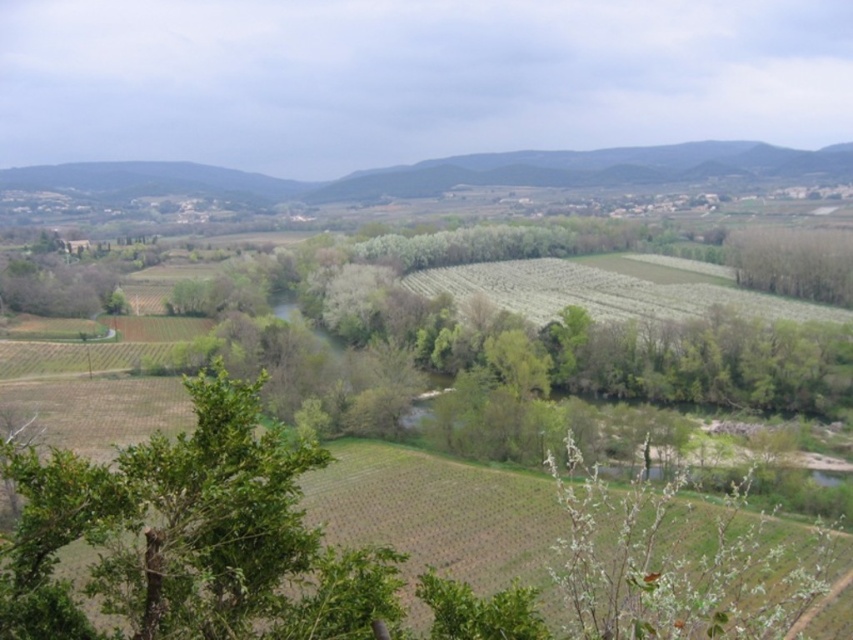
Which is more to the left, green leafy tree at lower left or green leafy trees at right?

A: From the viewer's perspective, green leafy tree at lower left appears more on the left side.

Does point (351, 608) come behind point (846, 304)?

No, it is in front of (846, 304).

The image size is (853, 640). Find the location of `green leafy tree at lower left`. green leafy tree at lower left is located at coordinates (189, 536).